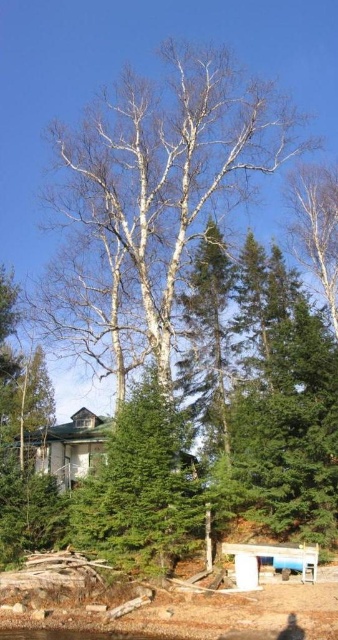
Is white smooth birch tree at center below green matte evergreen tree at center?

No, white smooth birch tree at center is not below green matte evergreen tree at center.

Which of these two, white smooth birch tree at center or green matte evergreen tree at center, stands taller?

white smooth birch tree at center

Locate an element on the screen. white smooth birch tree at center is located at coordinates (171, 168).

The image size is (338, 640). What are the coordinates of `white smooth birch tree at center` in the screenshot? It's located at (171, 168).

Is point (154, 428) positioned behind point (242, 556)?

Yes, it is behind point (242, 556).

This screenshot has height=640, width=338. I want to click on green matte evergreen tree at center, so click(141, 488).

Based on the photo, between white smooth birch tree at center and wooden park bench at lower center, which one appears on the right side from the viewer's perspective?

wooden park bench at lower center is more to the right.

Is point (126, 232) positioned behind point (227, 550)?

Yes, it is behind point (227, 550).

This screenshot has width=338, height=640. Describe the element at coordinates (171, 168) in the screenshot. I see `white smooth birch tree at center` at that location.

Find the location of `white smooth birch tree at center`. white smooth birch tree at center is located at coordinates (171, 168).